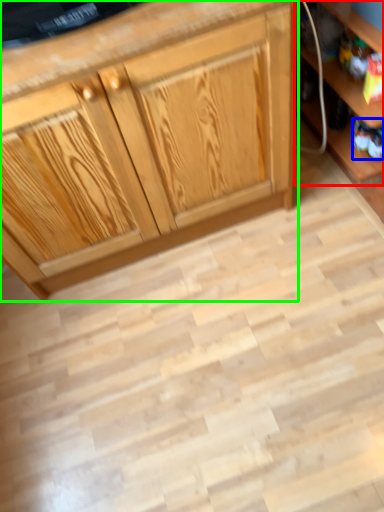
Question: Which is farther away from shelf (highlighted by a red box)? toy (highlighted by a blue box) or cabinetry (highlighted by a green box)?

Choices:
 (A) toy
 (B) cabinetry

Answer: (B)